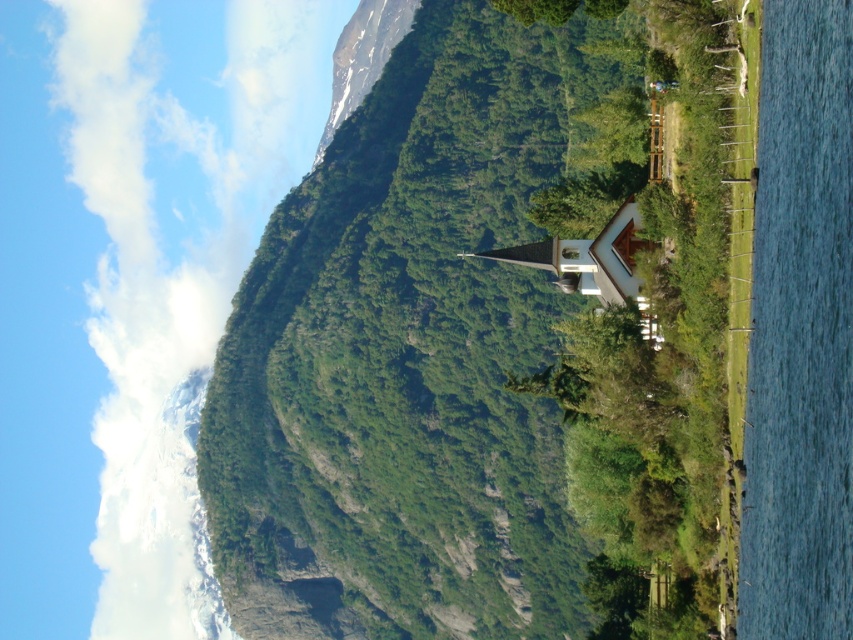
Question: Does green textured mountain at center have a greater width compared to white wooden chapel at center?

Choices:
 (A) no
 (B) yes

Answer: (B)

Question: Is green textured mountain at center wider than white wooden chapel at center?

Choices:
 (A) yes
 (B) no

Answer: (A)

Question: Which point appears farthest from the camera in this image?

Choices:
 (A) (426, 323)
 (B) (630, 220)

Answer: (A)

Question: Which point is farther to the camera?

Choices:
 (A) white wooden chapel at center
 (B) green textured mountain at center

Answer: (A)

Question: Which point is closer to the camera taking this photo?

Choices:
 (A) tap(622, 228)
 (B) tap(610, 506)

Answer: (A)

Question: Can you confirm if green textured mountain at center is bigger than white wooden chapel at center?

Choices:
 (A) no
 (B) yes

Answer: (B)